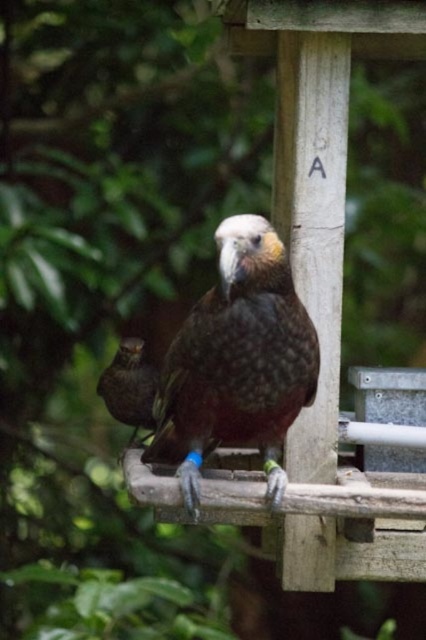
You are a birdwatcher observing two birds on a wooden structure. You see the dark brown feathers at center and the brown speckled feathers at center. Which of these birds is positioned to the right side?

The dark brown feathers at center is positioned to the right of the brown speckled feathers at center.

You are a birdwatcher observing two birds on a wooden structure. You notice the dark brown feathers at center and the brown speckled feathers at center. Which one is positioned higher up?

The dark brown feathers at center is above the brown speckled feathers at center, so it is positioned higher up.

You are a wildlife researcher observing two birds on a wooden structure. You need to determine if they are close enough to interact. The minimum distance required for bird interaction is 20 inches. Are the dark brown feathers at center and brown speckled feathers at center within this distance?

The distance between the dark brown feathers at center and brown speckled feathers at center is 22.64 inches, which is slightly more than the 20 inches required for interaction. Therefore, they are not close enough to interact.